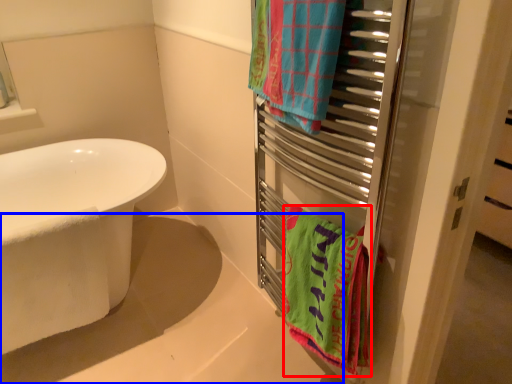
Question: Which of the following is the farthest to the observer, towel/napkin (highlighted by a red box) or bath (highlighted by a blue box)?

Choices:
 (A) towel/napkin
 (B) bath

Answer: (A)